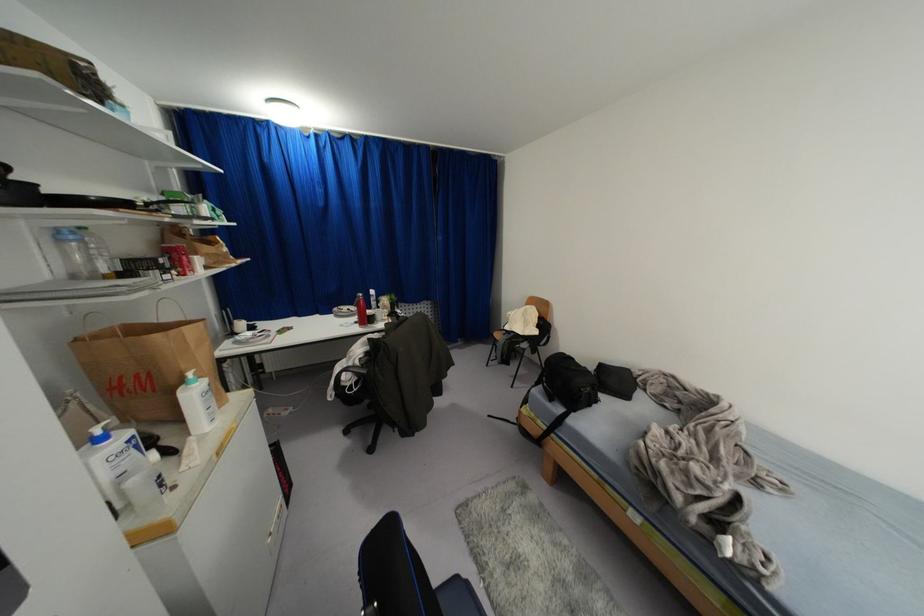
This screenshot has height=616, width=924. What are the coordinates of `red water bottle` in the screenshot? It's located at (360, 310).